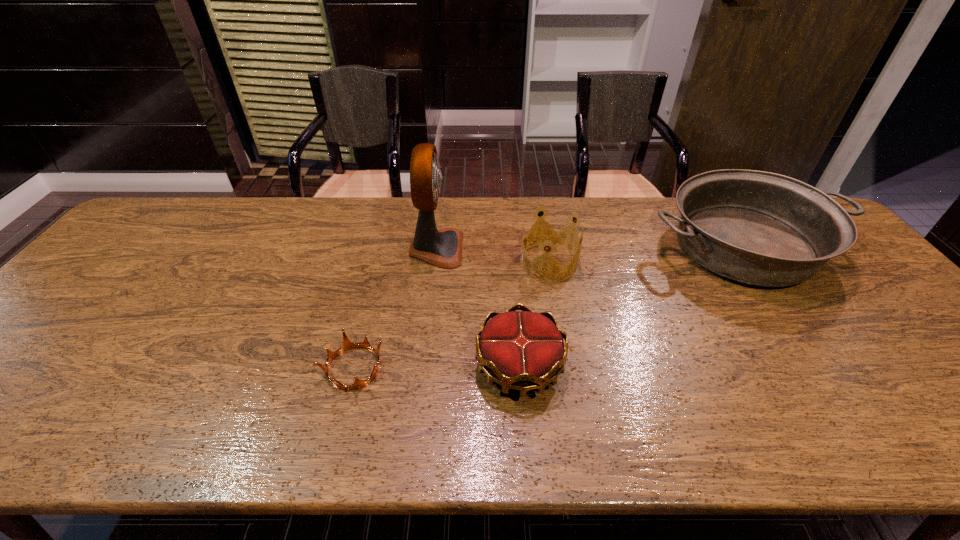
Where is `vacant space located on the right of the second shortest crown`? The image size is (960, 540). vacant space located on the right of the second shortest crown is located at coordinates (638, 367).

Locate an element on the screen. Image resolution: width=960 pixels, height=540 pixels. vacant space located on the front of the leftmost crown is located at coordinates (341, 420).

Locate an element on the screen. This screenshot has height=540, width=960. fan at the far edge is located at coordinates (443, 248).

The height and width of the screenshot is (540, 960). What are the coordinates of `pan located at the far edge` in the screenshot? It's located at (760, 228).

Image resolution: width=960 pixels, height=540 pixels. Identify the location of object present at the right edge. (760, 228).

Where is `object situated at the far right corner`? object situated at the far right corner is located at coordinates (760, 228).

In the image, there is a desktop. Where is `blank space at the far edge`? The image size is (960, 540). blank space at the far edge is located at coordinates (677, 235).

In the image, there is a desktop. Identify the location of vacant area at the near edge. The width and height of the screenshot is (960, 540). (229, 438).

The image size is (960, 540). Find the location of `free space at the left edge`. free space at the left edge is located at coordinates (80, 294).

Identify the location of vacant space at the right edge of the desktop. (864, 282).